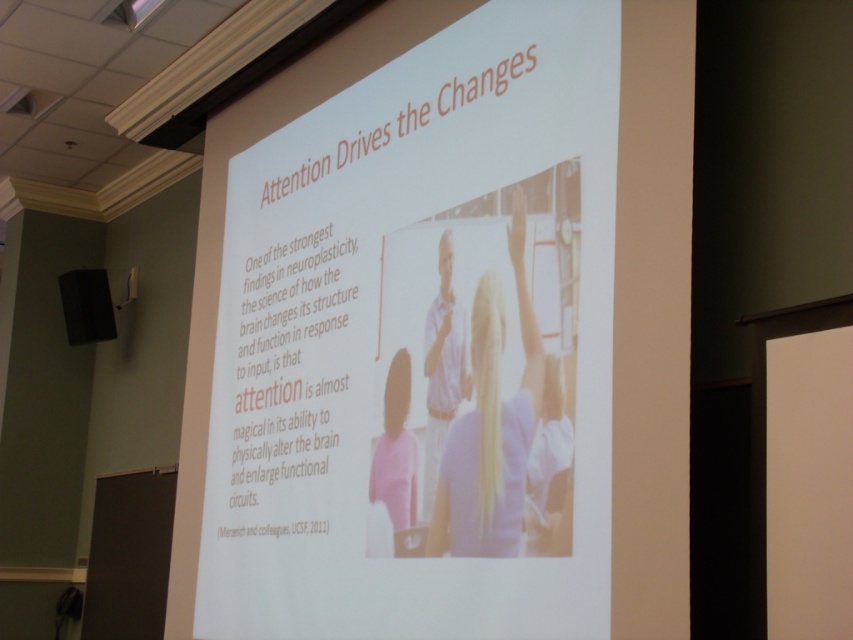
Based on the scene described, which object is taller, the white shirt at center or the matte black speaker at left?

The white shirt at center is much taller than the matte black speaker at left.

You are a photographer trying to capture a closeup shot of both the white shirt at center and the pink matte shirt at lower center in the slide. The camera you are using has a maximum focus range of 16 inches. Can you fit both shirts into the frame without moving the camera?

The white shirt at center and the pink matte shirt at lower center are 16.27 inches apart from each other. Since the camera can only focus within 16 inches, the distance between them exceeds the maximum focus range. Therefore, you cannot fit both shirts into the frame without moving the camera.

You are standing in front of the presentation slide and want to point to the white shirt at center. What are the coordinates where you should aim your pointer?

The white shirt at center is located at coordinates point (491, 426).